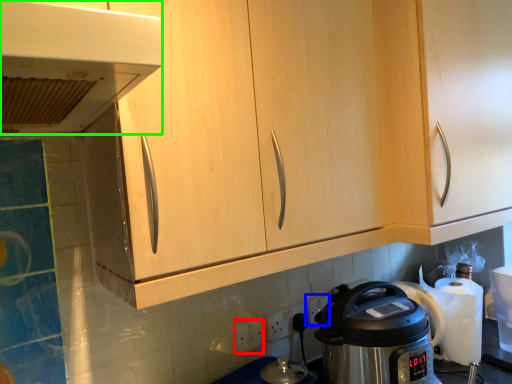
Question: Which object is the closest to the electric outlet (highlighted by a red box)? Choose among these: electric outlet (highlighted by a blue box) or home appliance (highlighted by a green box).

Choices:
 (A) electric outlet
 (B) home appliance

Answer: (A)